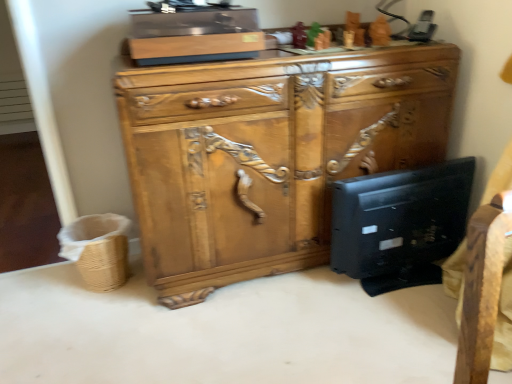
The width and height of the screenshot is (512, 384). Identify the location of free area in between wooden carved cabinet at center and woven brown basket at lower left. (121, 301).